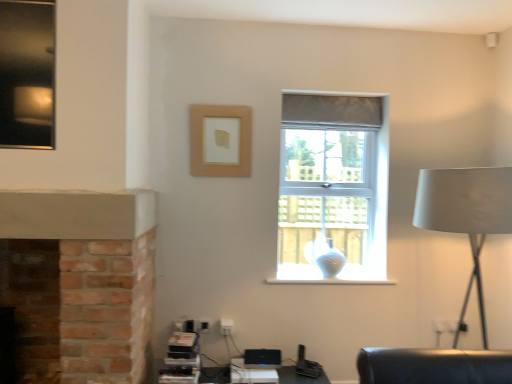
The height and width of the screenshot is (384, 512). Find the location of `empty space that is ontop of white plastic table at lower center (from a real-world perspective)`. empty space that is ontop of white plastic table at lower center (from a real-world perspective) is located at coordinates (258, 371).